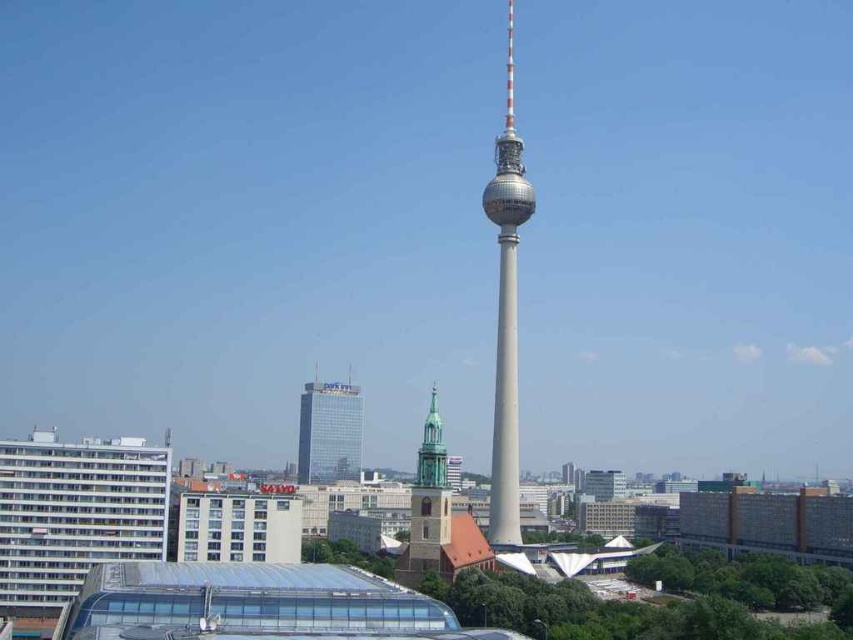
Does smooth gray tower at center have a greater height compared to glassy metallic skyscraper at center?

Indeed, smooth gray tower at center has a greater height compared to glassy metallic skyscraper at center.

Describe the element at coordinates (506, 314) in the screenshot. The height and width of the screenshot is (640, 853). I see `smooth gray tower at center` at that location.

Describe the element at coordinates (506, 314) in the screenshot. I see `smooth gray tower at center` at that location.

Where is `smooth gray tower at center`? Image resolution: width=853 pixels, height=640 pixels. smooth gray tower at center is located at coordinates (506, 314).

What are the coordinates of `smooth gray tower at center` in the screenshot? It's located at (506, 314).

Where is `smooth gray tower at center`? The image size is (853, 640). smooth gray tower at center is located at coordinates (506, 314).

Is glassy metallic skyscraper at center below brown stone church steeple at center?

Yes.

Who is shorter, glassy metallic skyscraper at center or brown stone church steeple at center?

With less height is glassy metallic skyscraper at center.

Is point (358, 397) closer to viewer compared to point (419, 502)?

No, it is not.

Locate an element on the screen. The width and height of the screenshot is (853, 640). glassy metallic skyscraper at center is located at coordinates (329, 433).